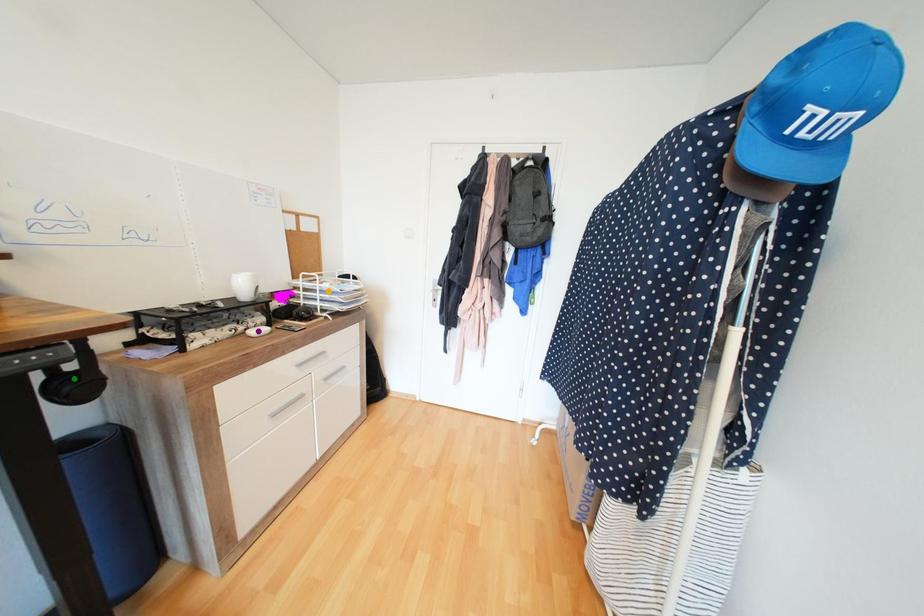
In the scene shown: Order these from farthest to nearest:
1. purple point
2. orange point
3. green point

orange point < purple point < green point